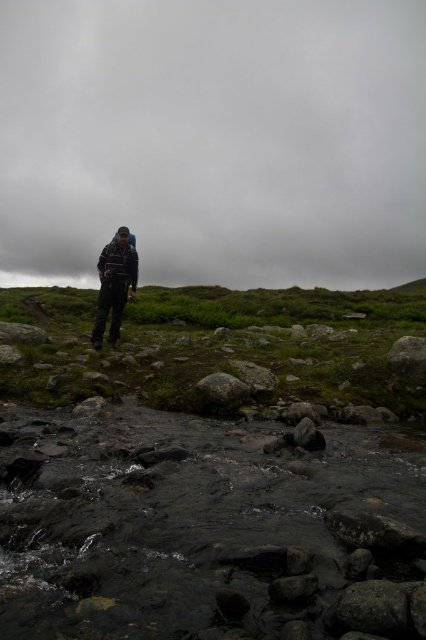
Is point (5, 308) closer to camera compared to point (212, 400)?

No, (5, 308) is further to viewer.

Can you confirm if dark green grass at left is positioned below green mossy rock at center?

No.

Locate an element on the screen. The image size is (426, 640). dark green grass at left is located at coordinates (218, 342).

Who is positioned more to the right, dark green grass at left or dark blue fabric backpack at center?

From the viewer's perspective, dark green grass at left appears more on the right side.

Is dark green grass at left thinner than dark blue fabric backpack at center?

No.

Who is more distant from viewer, (x=25, y=374) or (x=104, y=278)?

The point (x=104, y=278) is more distant.

Locate an element on the screen. dark green grass at left is located at coordinates (218, 342).

Does dark blue fabric backpack at center have a greater width compared to green mossy rock at center?

Yes.

Can you confirm if dark blue fabric backpack at center is thinner than green mossy rock at center?

In fact, dark blue fabric backpack at center might be wider than green mossy rock at center.

Measure the distance between dark blue fabric backpack at center and camera.

dark blue fabric backpack at center is 35.97 feet from camera.

The width and height of the screenshot is (426, 640). What are the coordinates of `dark blue fabric backpack at center` in the screenshot? It's located at (115, 284).